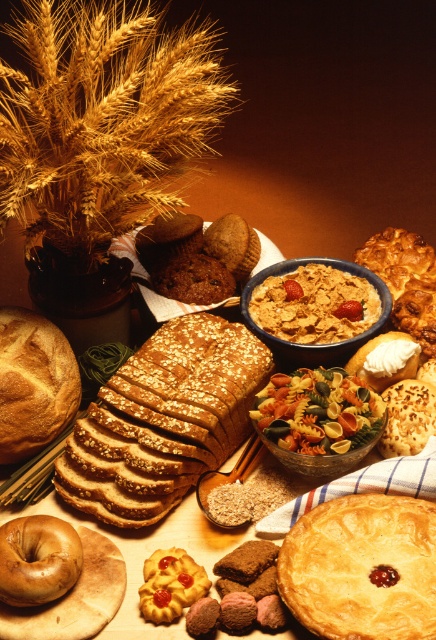
Looking at this image, you are arranging a food display and want to place a new item between the golden flaky pie at center and the golden brown crusty loaf of bread at left. Based on their positions, where should you place the new item?

The golden flaky pie at center is below the golden brown crusty loaf of bread at left, so you should place the new item between them in the space between the golden flaky pie at center and the golden brown crusty loaf of bread at left, which is above the pie and below the loaf of bread.